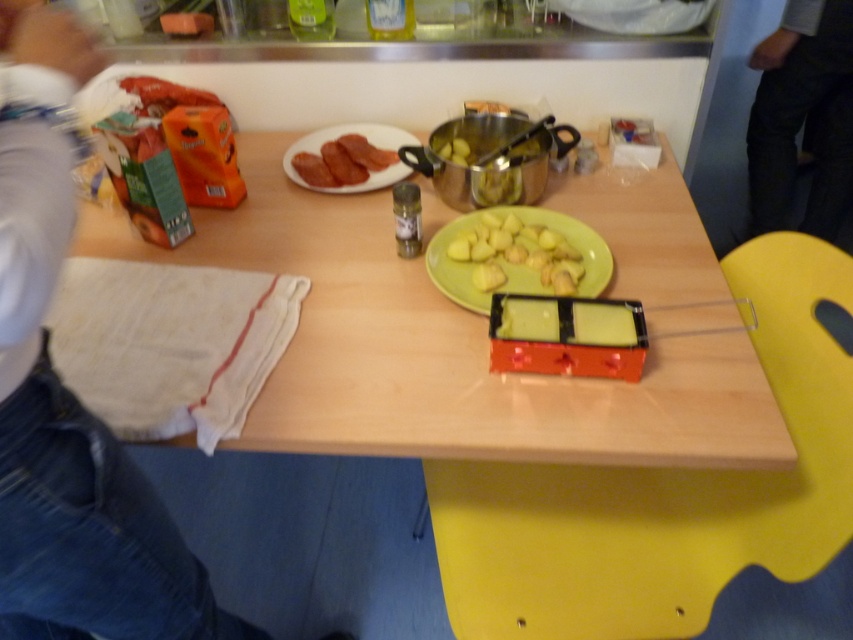
Question: Considering the relative positions of wooden table at center and dark gray pants at right in the image provided, where is wooden table at center located with respect to dark gray pants at right?

Choices:
 (A) below
 (B) above

Answer: (A)

Question: Does wooden table at center appear under denim pants at lower left?

Choices:
 (A) no
 (B) yes

Answer: (A)

Question: Does dark gray pants at right have a greater width compared to matte white plate at upper center?

Choices:
 (A) yes
 (B) no

Answer: (A)

Question: Which point appears farthest from the camera in this image?

Choices:
 (A) (593, 294)
 (B) (412, 144)

Answer: (B)

Question: Estimate the real-world distances between objects in this image. Which object is farther from the denim pants at lower left?

Choices:
 (A) dark gray pants at right
 (B) matte white plate at upper center

Answer: (A)

Question: Considering the real-world distances, which object is farthest from the dark gray pants at right?

Choices:
 (A) yellow matte potatoes at center
 (B) matte white plate at upper center
 (C) denim pants at lower left
 (D) wooden table at center

Answer: (C)